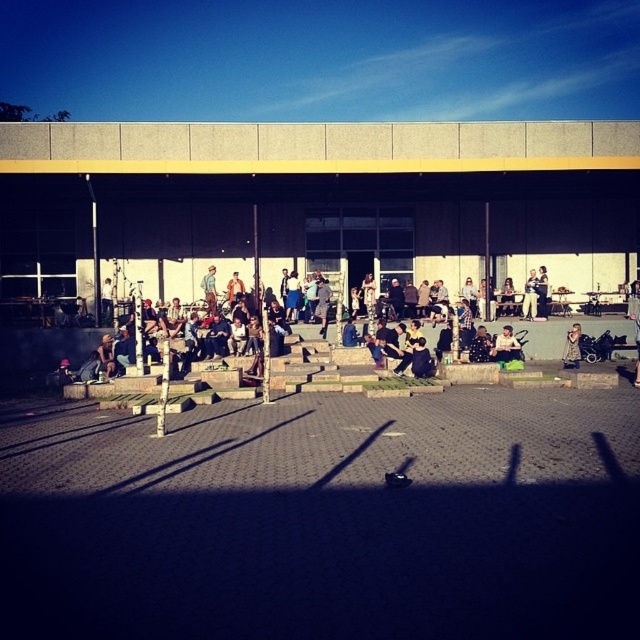
You are standing in the outdoor area and want to pick up both the matte black jacket at center and the denim jacket at lower right. Which jacket should you reach for first to grab the one closer to you?

The matte black jacket at center is closer to the viewer than the denim jacket at lower right, so you should reach for the matte black jacket at center first.

You are a photographer wanting to capture both the matte black jacket at center and the denim jacket at lower right in a single frame. Based on their positions, which jacket is closer to the bottom edge of your camera view?

The matte black jacket at center is below denim jacket at lower right, so the matte black jacket at center is closer to the bottom edge of the camera view.

You are standing at the center of the paved area and see the matte black jacket at center and a camera. Which object is closer to you?

Both the matte black jacket at center and the camera are at the same distance from you since you are standing at the center where the matte black jacket is located.